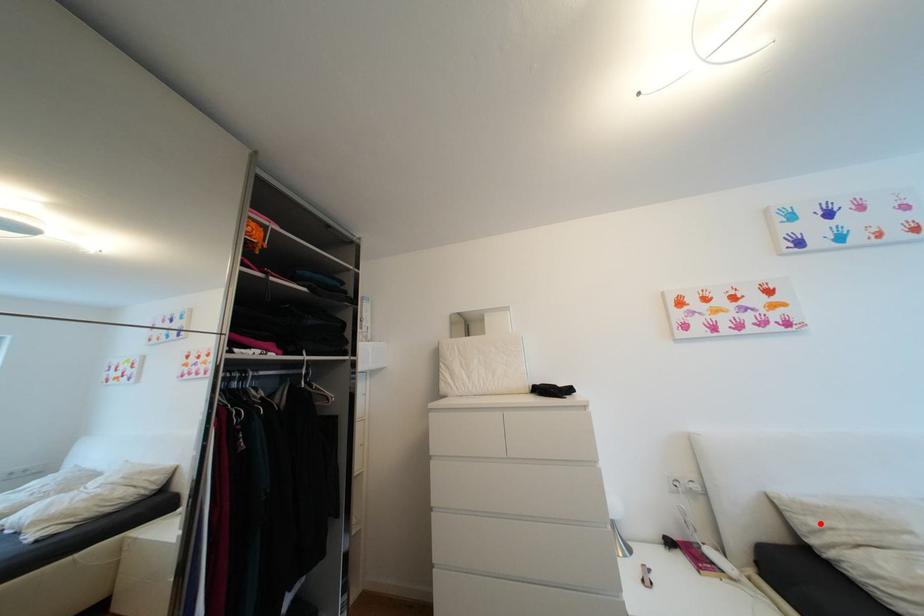
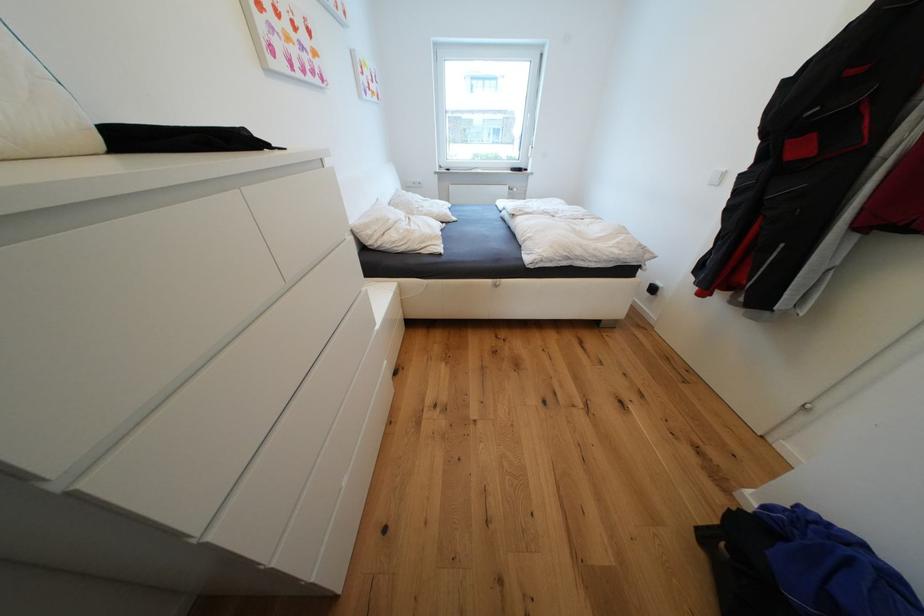
Question: I am providing you with two images of the same scene from different viewpoints. A red point is shown in image1. For the corresponding object point in image2, is it positioned nearer or farther from the camera?

Choices:
 (A) Nearer
 (B) Farther

Answer: (A)